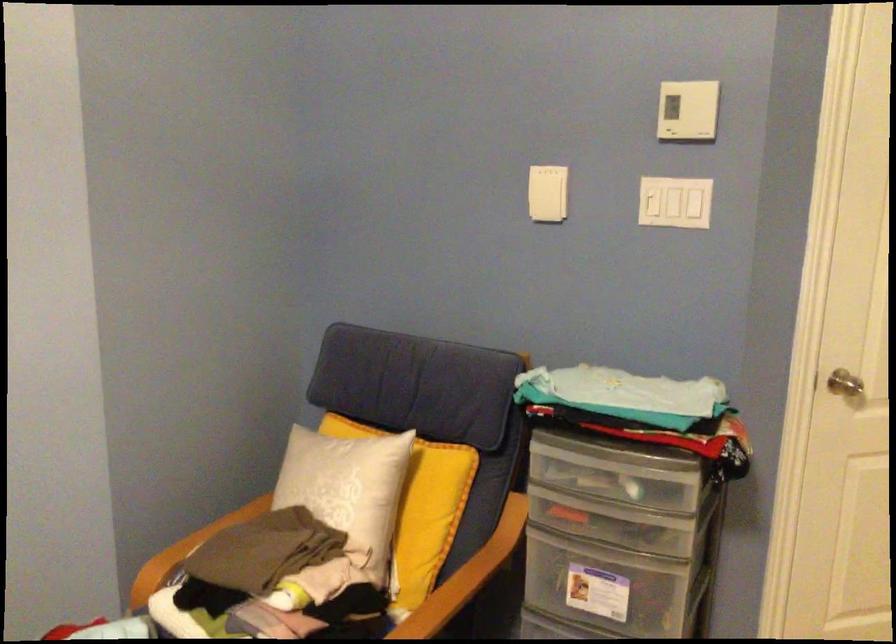
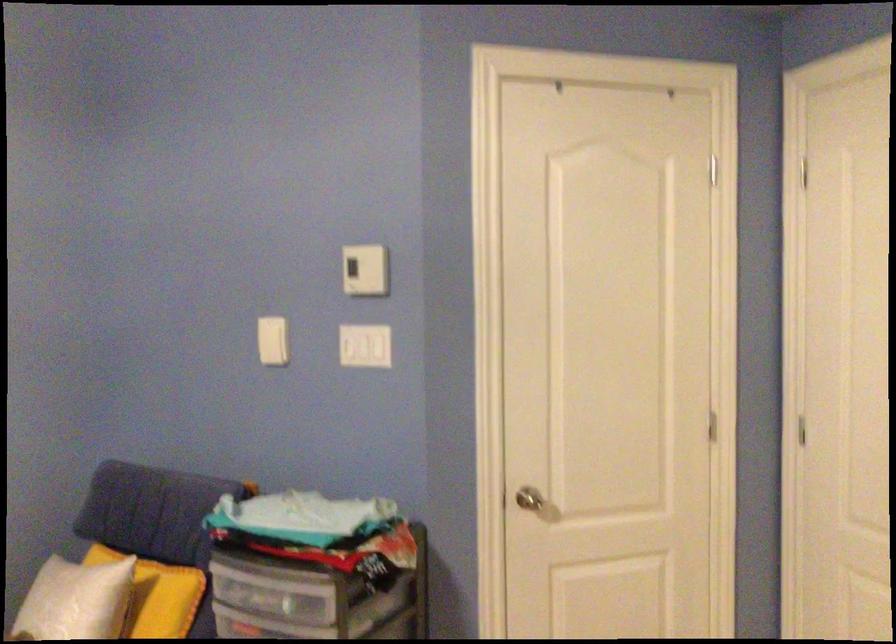
Locate, in the second image, the point that corresponds to pixel 424 467 in the first image.

(157, 594)